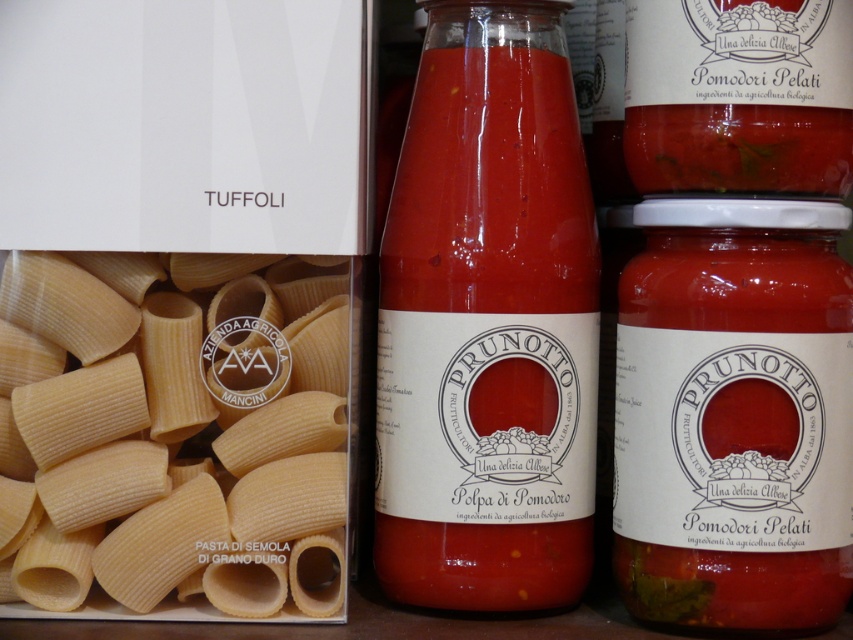
Question: Does yellow semolina pasta at center come in front of translucent glass bottle at center?

Choices:
 (A) no
 (B) yes

Answer: (B)

Question: Which object appears farthest from the camera in this image?

Choices:
 (A) translucent glass bottle at center
 (B) yellow semolina pasta at center

Answer: (A)

Question: Can you confirm if yellow semolina pasta at center is bigger than translucent glass bottle at center?

Choices:
 (A) yes
 (B) no

Answer: (B)

Question: Can you confirm if yellow semolina pasta at center is wider than translucent glass bottle at center?

Choices:
 (A) yes
 (B) no

Answer: (A)